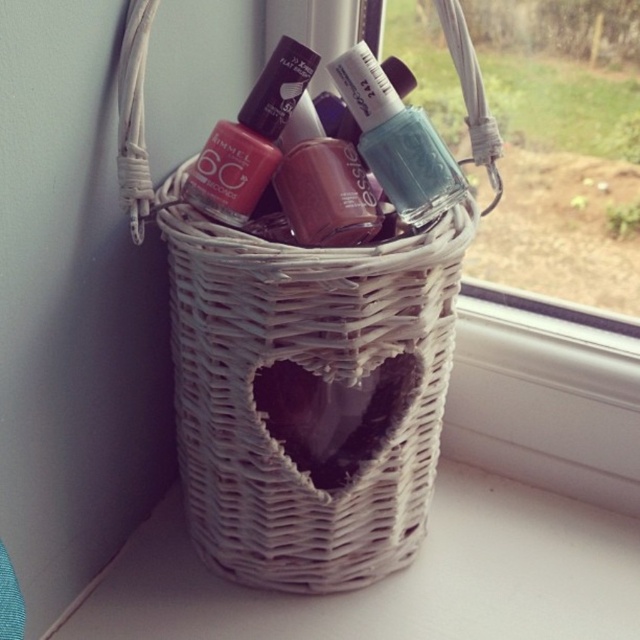
Question: Among these points, which one is nearest to the camera?

Choices:
 (A) (282, 134)
 (B) (547, 304)
 (C) (422, 140)
 (D) (337, 333)

Answer: (D)

Question: Is matte plastic nail polish at center to the right of transparent glass nail polish bottles at upper center from the viewer's perspective?

Choices:
 (A) no
 (B) yes

Answer: (A)

Question: Which point is farther to the camera?

Choices:
 (A) (314, 115)
 (B) (298, 568)

Answer: (B)

Question: Does white wicker basket at center appear on the left side of matte burgundy nail polish at center?

Choices:
 (A) no
 (B) yes

Answer: (B)

Question: Which is farther from the white wicker basket at center?

Choices:
 (A) teal glossy nail polish at center
 (B) white wicker basket at lower left
 (C) transparent glass nail polish bottles at upper center

Answer: (C)

Question: Can you confirm if white wicker basket at center is thinner than white wicker basket at lower left?

Choices:
 (A) yes
 (B) no

Answer: (A)